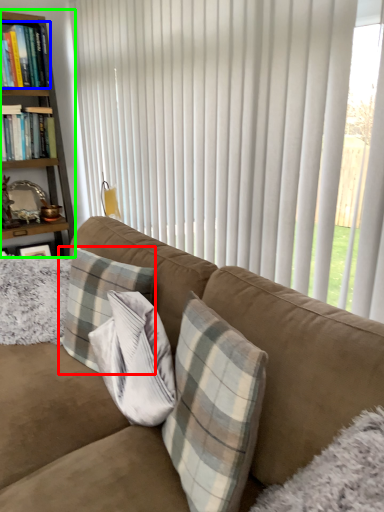
Question: Which is nearer to the pillow (highlighted by a red box)? book (highlighted by a blue box) or bookcase (highlighted by a green box).

Choices:
 (A) book
 (B) bookcase

Answer: (B)